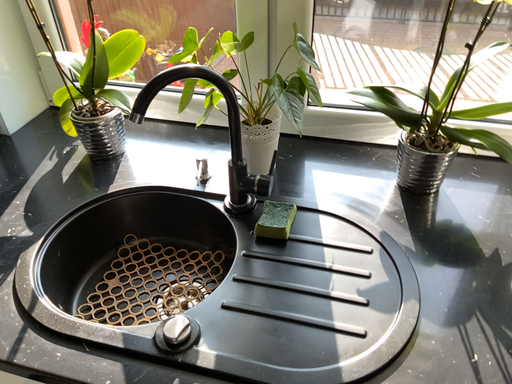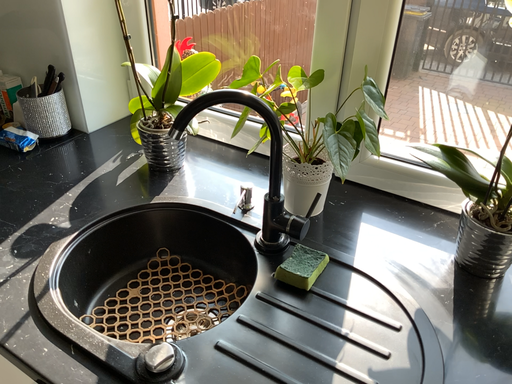
Question: Which way did the camera rotate in the video?

Choices:
 (A) rotated left
 (B) rotated right

Answer: (A)